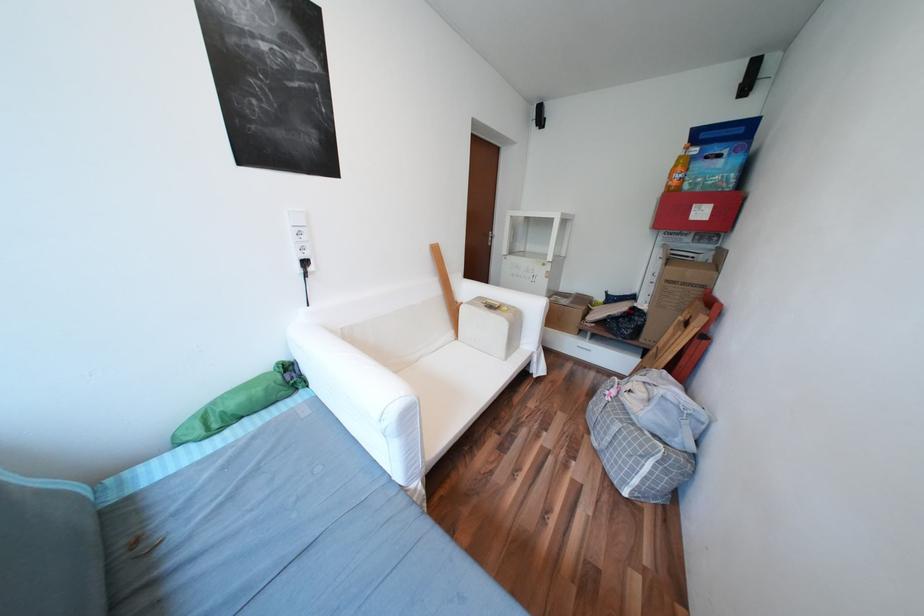
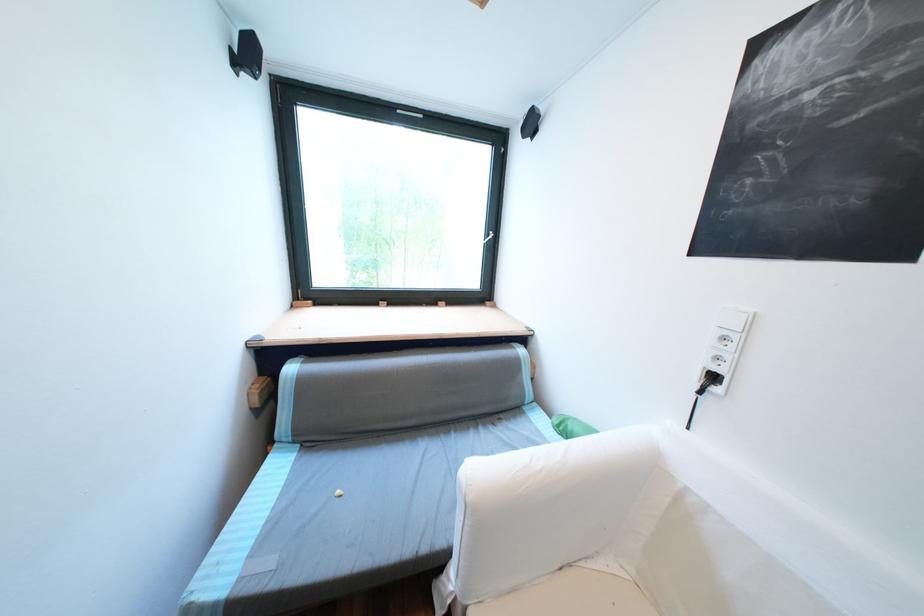
Find the pixel in the second image that matches pixel 320 270 in the first image.

(725, 390)